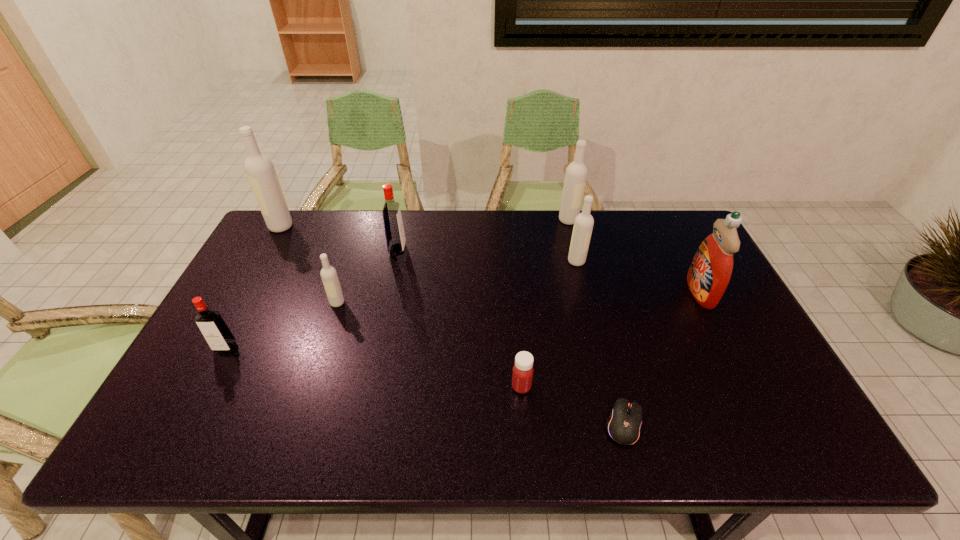
The image size is (960, 540). What are the coordinates of `the biggest white vodka` in the screenshot? It's located at (260, 170).

At what (x,y) coordinates should I click in order to perform the action: click on the tallest vodka. Please return your answer as a coordinate pair (x, y). The width and height of the screenshot is (960, 540). Looking at the image, I should click on (260, 170).

Locate an element on the screen. the second biggest white vodka is located at coordinates (576, 173).

This screenshot has width=960, height=540. What are the coordinates of `red detergent` in the screenshot? It's located at (709, 274).

Where is `detergent`? The image size is (960, 540). detergent is located at coordinates (709, 274).

Locate an element on the screen. The height and width of the screenshot is (540, 960). the third farthest white vodka is located at coordinates (583, 225).

You are a GUI agent. You are given a task and a screenshot of the screen. Output one action in this format:
    pyautogui.click(x=<x>, y=<y>)
    Task: Click on the right red vodka
    Image resolution: width=960 pixels, height=540 pixels.
    Given the screenshot: What is the action you would take?
    pyautogui.click(x=395, y=237)

I want to click on the sixth object from right to left, so click(395, 237).

This screenshot has height=540, width=960. I want to click on the nearest white vodka, so click(330, 280).

Find the location of a particular element. The height and width of the screenshot is (540, 960). the smallest white vodka is located at coordinates (330, 280).